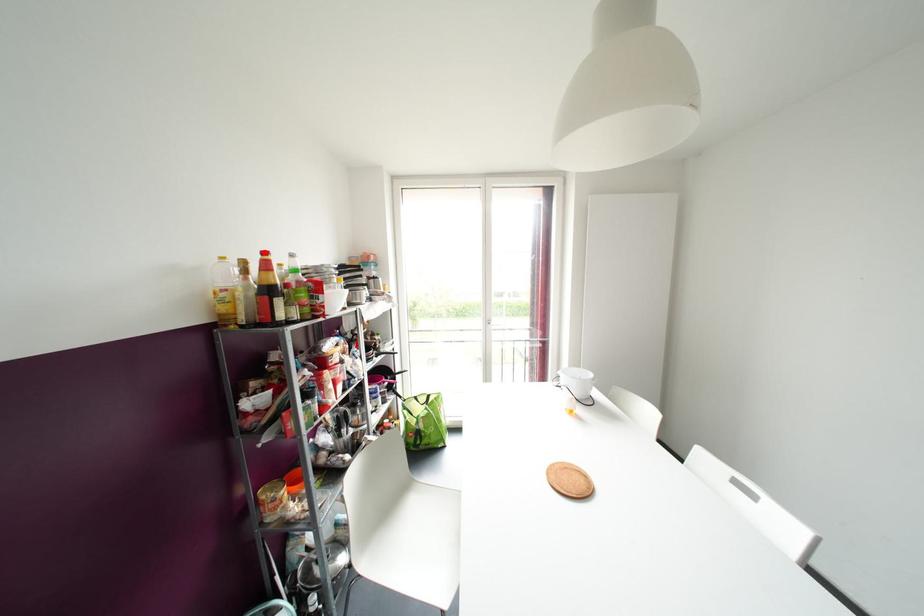
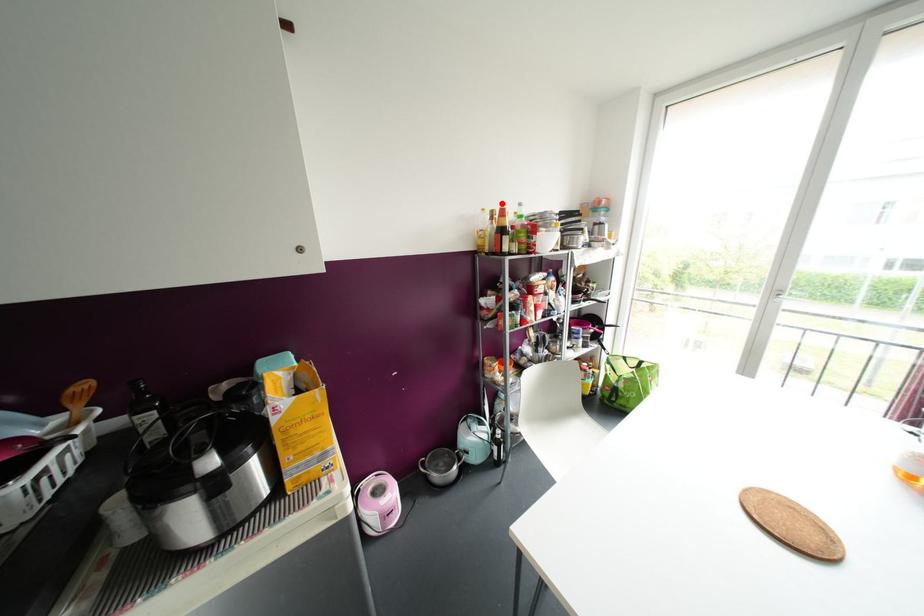
I am providing you with two images of the same scene from different viewpoints. A red point is marked on the first image and another point is marked on the second image. Does the point marked in image1 correspond to the same location as the one in image2?

Yes